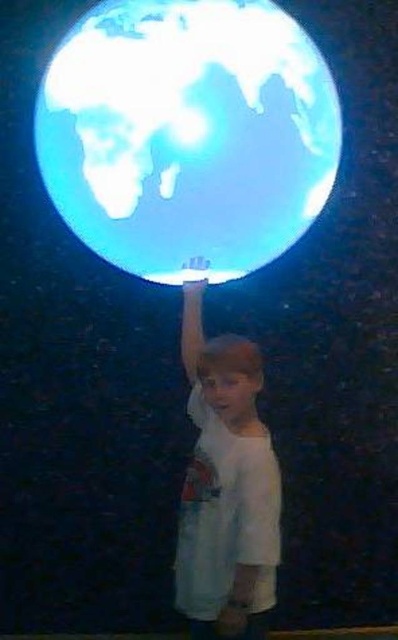
Question: Can you confirm if transparent glass globe at upper center is positioned to the right of white cotton shirt at center?

Choices:
 (A) yes
 (B) no

Answer: (B)

Question: Which point is farther to the camera?

Choices:
 (A) white cotton shirt at center
 (B) transparent glass globe at upper center

Answer: (B)

Question: Among these objects, which one is nearest to the camera?

Choices:
 (A) transparent glass globe at upper center
 (B) white cotton shirt at center

Answer: (B)

Question: Which point is closer to the camera taking this photo?

Choices:
 (A) (89, 36)
 (B) (200, 342)

Answer: (A)

Question: Does transparent glass globe at upper center appear on the right side of white cotton shirt at center?

Choices:
 (A) no
 (B) yes

Answer: (A)

Question: Does transparent glass globe at upper center appear on the right side of white cotton shirt at center?

Choices:
 (A) no
 (B) yes

Answer: (A)